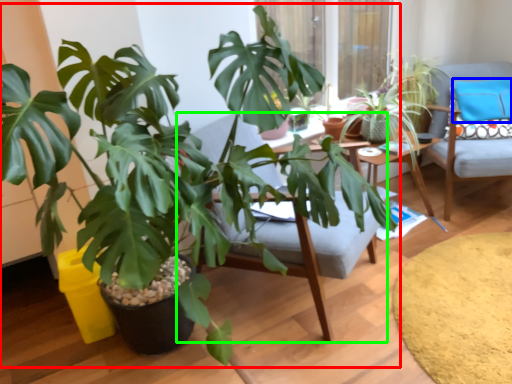
Question: Estimate the real-world distances between objects in this image. Which object is closer to houseplant (highlighted by a red box), pillow (highlighted by a blue box) or swivel chair (highlighted by a green box)?

Choices:
 (A) pillow
 (B) swivel chair

Answer: (B)